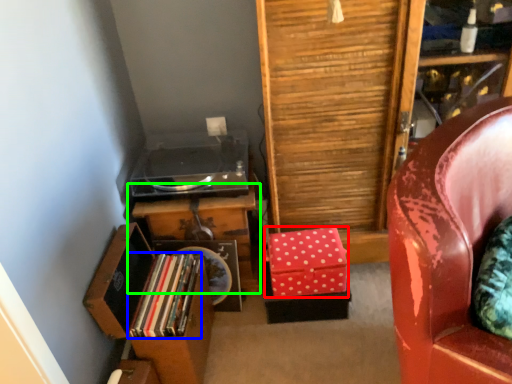
Question: Based on their relative distances, which object is nearer to box (highlighted by a red box)? Choose from book (highlighted by a blue box) and table (highlighted by a green box).

Choices:
 (A) book
 (B) table

Answer: (B)